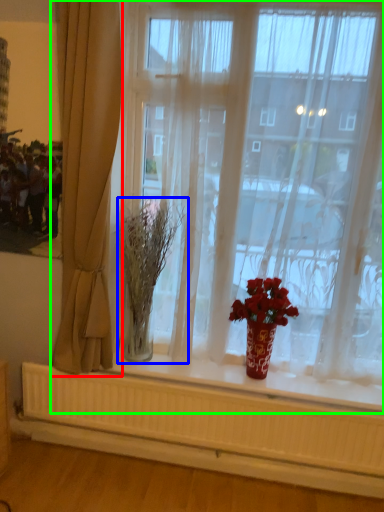
Question: Which object is positioned closest to curtain (highlighted by a red box)? Select from plant (highlighted by a blue box) and window (highlighted by a green box).

Choices:
 (A) plant
 (B) window

Answer: (A)